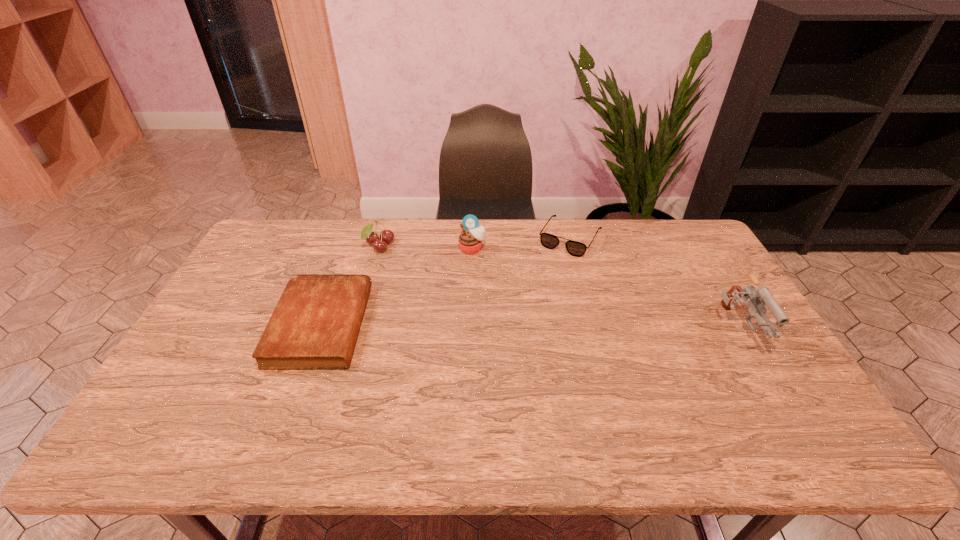
Where is `free spot on the desktop that is between the Bible and the gun and is positioned on the front-facing side of the fourth shortest object`? The image size is (960, 540). free spot on the desktop that is between the Bible and the gun and is positioned on the front-facing side of the fourth shortest object is located at coordinates (467, 326).

The width and height of the screenshot is (960, 540). What are the coordinates of `vacant space on the desktop that is between the Bible and the tallest object and is positioned on the front-facing side of the spectacles` in the screenshot? It's located at (516, 327).

This screenshot has width=960, height=540. Find the location of `vacant spot on the desktop that is between the Bible and the rightmost object and is positioned on the leaves of the third tallest object`. vacant spot on the desktop that is between the Bible and the rightmost object and is positioned on the leaves of the third tallest object is located at coordinates (479, 327).